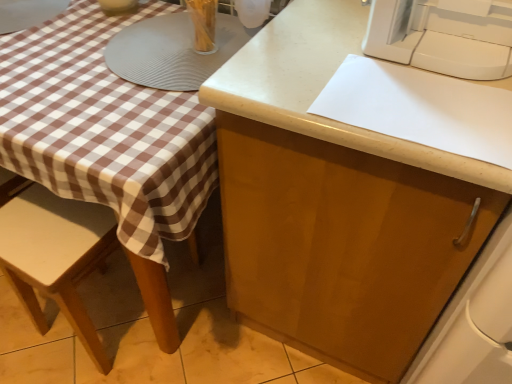
Find the location of `vacant region under wooden chair at lower left (from a real-world perspective)`. vacant region under wooden chair at lower left (from a real-world perspective) is located at coordinates (106, 314).